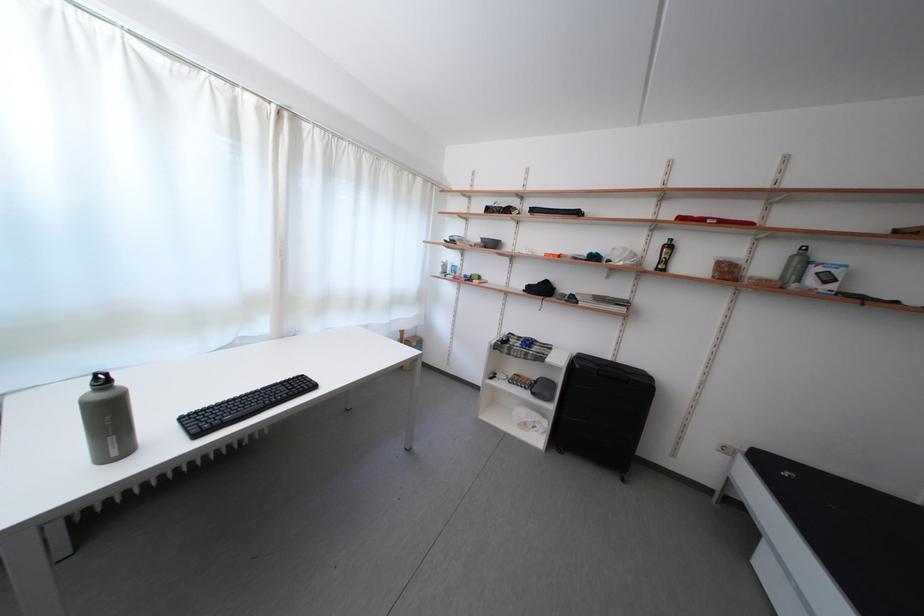
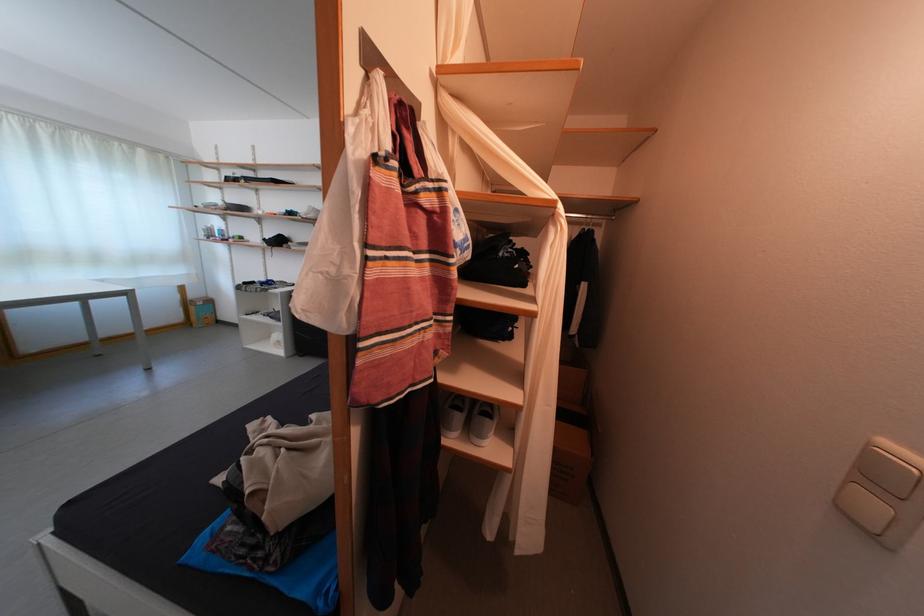
Where in the second image is the point corresponding to the point at 416,341 from the first image?

(201, 302)